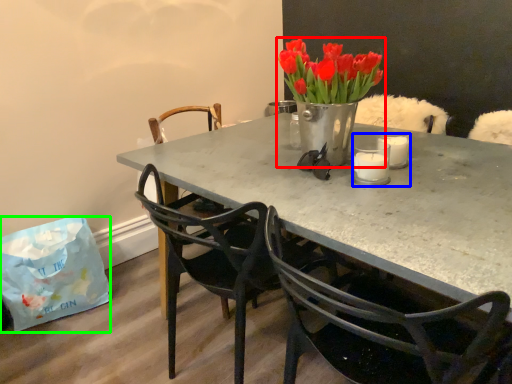
Question: Based on their relative distances, which object is farther from houseplant (highlighted by a red box)? Choose from candle holder (highlighted by a blue box) and handbag (highlighted by a green box).

Choices:
 (A) candle holder
 (B) handbag

Answer: (B)